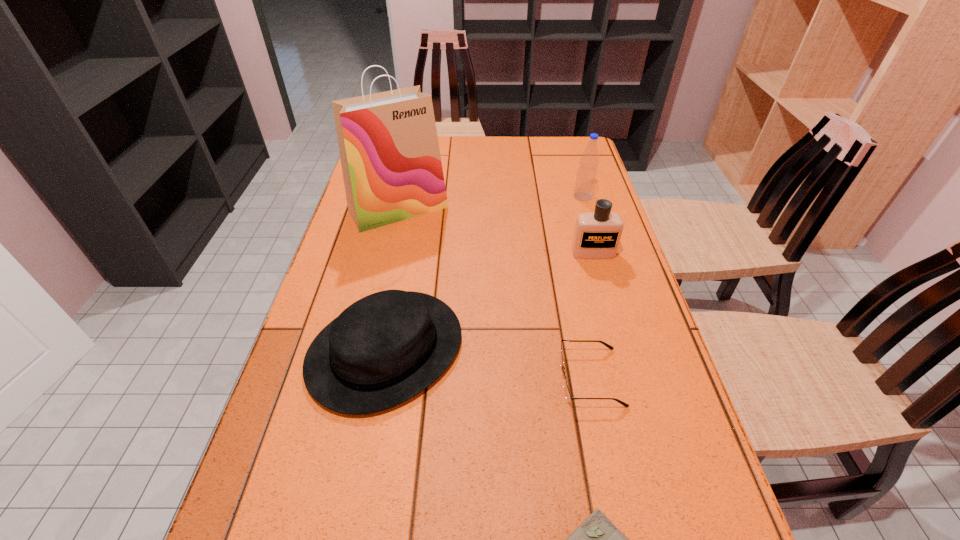
The width and height of the screenshot is (960, 540). Identify the location of free space located 0.300m on the front-facing side of the spectacles. (418, 377).

At what (x,y) coordinates should I click in order to perform the action: click on vacant position located on the front-facing side of the spectacles. Please return your answer as a coordinate pair (x, y). The image size is (960, 540). Looking at the image, I should click on click(469, 377).

I want to click on vacant space situated on the front-facing side of the spectacles, so click(x=380, y=377).

Locate an element on the screen. The image size is (960, 540). shopping bag that is at the left edge is located at coordinates (388, 144).

Locate an element on the screen. fedora present at the left edge is located at coordinates (384, 349).

You are a GUI agent. You are given a task and a screenshot of the screen. Output one action in this format:
    pyautogui.click(x=<x>, y=<y>)
    Task: Click on the water bottle that is at the right edge
    
    Given the screenshot: What is the action you would take?
    pyautogui.click(x=586, y=177)

Identify the location of perfume that is at the right edge. (597, 234).

The width and height of the screenshot is (960, 540). In order to click on spectacles at the right edge in this screenshot , I will do click(x=568, y=396).

In the image, there is a desktop. Where is `free space at the far edge`? The width and height of the screenshot is (960, 540). free space at the far edge is located at coordinates (525, 154).

The height and width of the screenshot is (540, 960). I want to click on vacant space at the left edge of the desktop, so click(x=382, y=242).